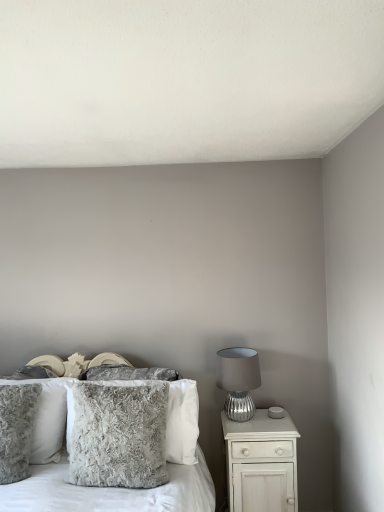
Question: Is fuzzy gray pillow at left, positioned as the 2th pillow in front-to-back order, smaller than fuzzy gray pillow at center, positioned as the second pillow in back-to-front order?

Choices:
 (A) no
 (B) yes

Answer: (B)

Question: Is fuzzy gray pillow at left, positioned as the 2th pillow in front-to-back order, outside of fuzzy gray pillow at center, which is the 3th pillow in front-to-back order?

Choices:
 (A) no
 (B) yes

Answer: (B)

Question: From the image's perspective, would you say fuzzy gray pillow at left, positioned as the 2th pillow in front-to-back order, is shown under fuzzy gray pillow at center, positioned as the second pillow in back-to-front order?

Choices:
 (A) no
 (B) yes

Answer: (A)

Question: Does fuzzy gray pillow at left, the 3th pillow when ordered from back to front, have a greater height compared to fuzzy gray pillow at center, positioned as the second pillow in back-to-front order?

Choices:
 (A) no
 (B) yes

Answer: (B)

Question: From a real-world perspective, does fuzzy gray pillow at left, the 3th pillow when ordered from back to front, stand above fuzzy gray pillow at center, which is the 3th pillow in front-to-back order?

Choices:
 (A) yes
 (B) no

Answer: (A)

Question: Is fuzzy gray pillow at left, the 3th pillow when ordered from back to front, further to the viewer compared to fuzzy gray pillow at center, positioned as the second pillow in back-to-front order?

Choices:
 (A) no
 (B) yes

Answer: (A)

Question: Considering the relative sizes of fuzzy gray pillow at center, the 4th pillow viewed from the back, and fuzzy gray pillow at left, positioned as the 2th pillow in front-to-back order, in the image provided, is fuzzy gray pillow at center, the 4th pillow viewed from the back, taller than fuzzy gray pillow at left, positioned as the 2th pillow in front-to-back order,?

Choices:
 (A) no
 (B) yes

Answer: (A)

Question: Would you consider fuzzy gray pillow at center, the 4th pillow viewed from the back, to be distant from fuzzy gray pillow at left, positioned as the 2th pillow in front-to-back order?

Choices:
 (A) yes
 (B) no

Answer: (B)

Question: Is fuzzy gray pillow at center, the 4th pillow viewed from the back, outside fuzzy gray pillow at left, positioned as the 2th pillow in front-to-back order?

Choices:
 (A) no
 (B) yes

Answer: (B)

Question: Can you confirm if fuzzy gray pillow at center, which is the first pillow in front-to-back order, is smaller than fuzzy gray pillow at left, positioned as the 2th pillow in front-to-back order?

Choices:
 (A) yes
 (B) no

Answer: (B)

Question: Are fuzzy gray pillow at center, the 4th pillow viewed from the back, and fuzzy gray pillow at left, positioned as the 2th pillow in front-to-back order, making contact?

Choices:
 (A) yes
 (B) no

Answer: (B)

Question: From the image's perspective, is fuzzy gray pillow at center, the 4th pillow viewed from the back, below fuzzy gray pillow at left, the 3th pillow when ordered from back to front?

Choices:
 (A) yes
 (B) no

Answer: (B)

Question: Is white glossy nightstand at right a part of fuzzy gray pillow at center?

Choices:
 (A) no
 (B) yes

Answer: (A)